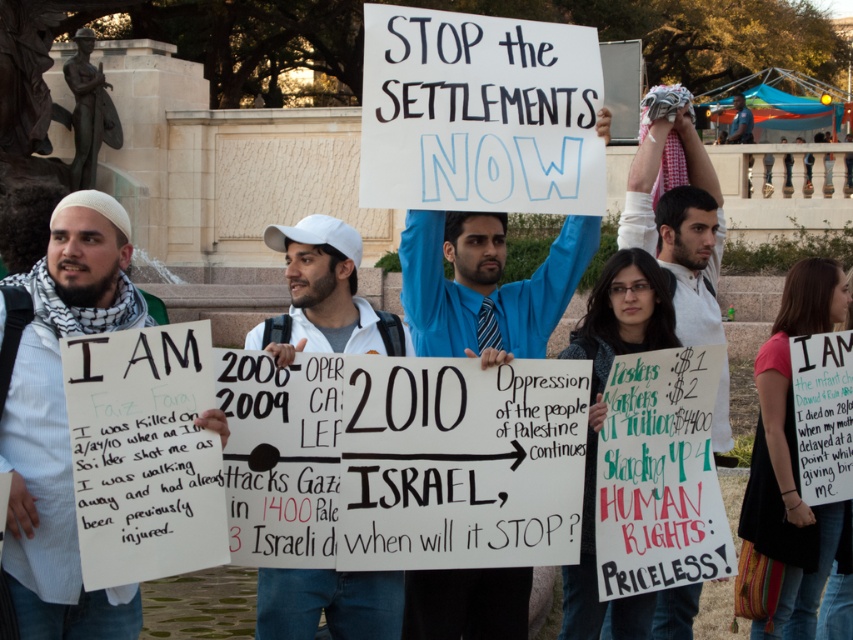
Is blue shirt at center below white cotton cap at center?

Incorrect, blue shirt at center is not positioned below white cotton cap at center.

Can you confirm if blue shirt at center is taller than white cotton cap at center?

No, blue shirt at center is not taller than white cotton cap at center.

Who is more distant from viewer, (503, 577) or (291, 589)?

The point (503, 577) is more distant.

The height and width of the screenshot is (640, 853). I want to click on blue shirt at center, so click(485, 284).

Which of these two, white striped scarf at left or white cotton shirt at upper right, stands shorter?

white striped scarf at left

Is point (33, 483) farther from viewer compared to point (717, 326)?

No, (33, 483) is in front of (717, 326).

The width and height of the screenshot is (853, 640). I want to click on white striped scarf at left, so click(x=59, y=417).

The width and height of the screenshot is (853, 640). What do you see at coordinates (59, 417) in the screenshot?
I see `white striped scarf at left` at bounding box center [59, 417].

Is white striped scarf at left positioned in front of blue shirt at center?

That is True.

Between point (102, 317) and point (492, 291), which one is positioned in front?

Point (102, 317) is more forward.

Locate an element on the screen. white striped scarf at left is located at coordinates (59, 417).